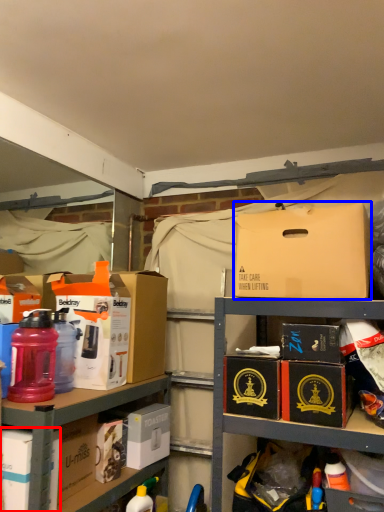
Question: Which object appears farthest to the camera in this image, box (highlighted by a red box) or box (highlighted by a blue box)?

Choices:
 (A) box
 (B) box

Answer: (B)